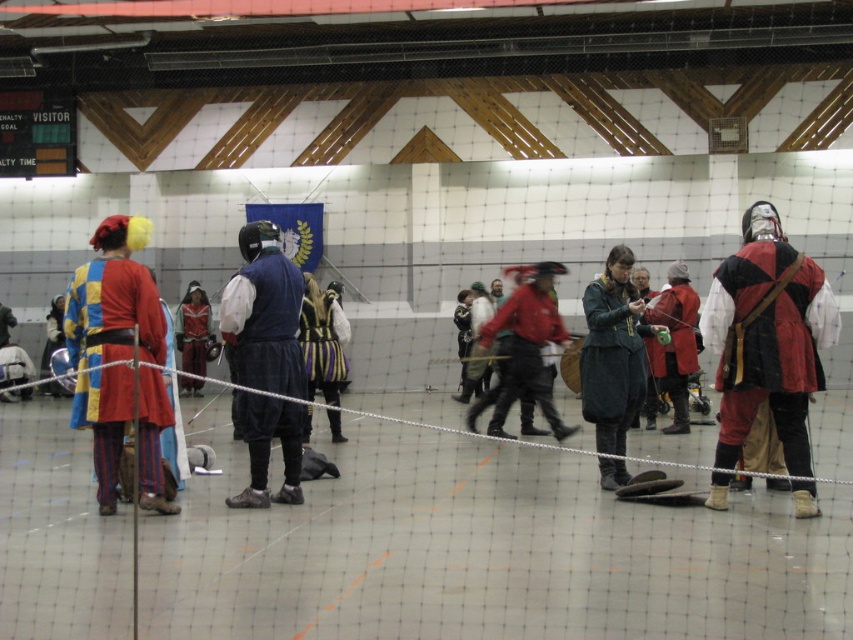
You are an event organizer planning to arrange two costumes on a display rack. The rack has a limited width. The matte multicolored tunic at left and the matte blue vest at center need to be placed side by side. Based on their sizes, which costume should be placed first to ensure they both fit on the rack?

The matte multicolored tunic at left has a larger width than the matte blue vest at center, so it should be placed first on the rack to accommodate its size before placing the smaller matte blue vest at center.

You are standing in the indoor arena and see the point marked at coordinates (119, 358). What object is located at that point?

The point at coordinates (119, 358) indicates the location of the matte multicolored tunic at left.

Consider the image. You are a costume designer observing the indoor arena scene. You need to place a new accessory between the matte multicolored tunic at left and the matte blue vest at center. Based on their current positions, where should you place the accessory so that it is between them?

The accessory should be placed between the matte multicolored tunic at left and the matte blue vest at center, positioned to the right of the matte multicolored tunic at left and to the left of the matte blue vest at center since the matte multicolored tunic at left is on the left side of the matte blue vest at center.